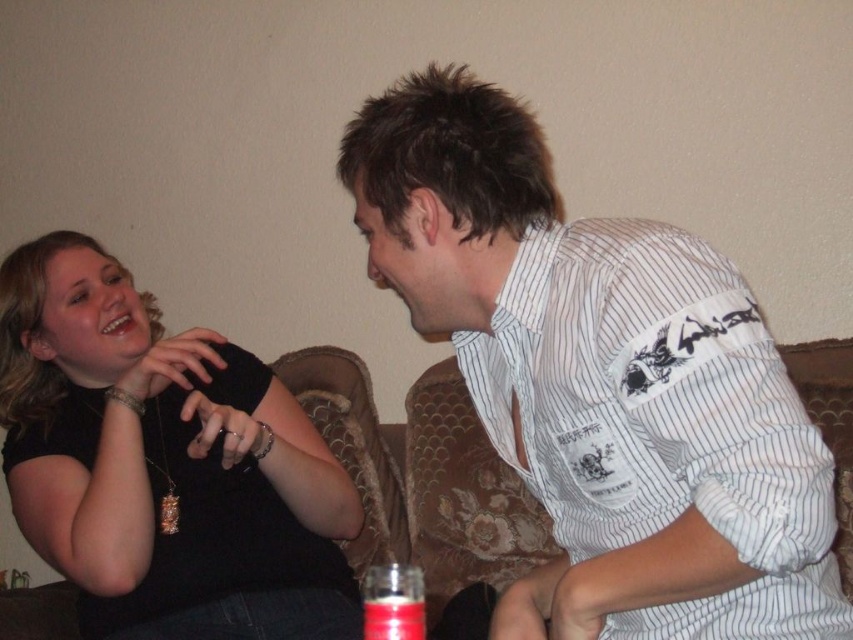
Question: Based on their relative distances, which object is nearer to the translucent glass bottle at lower center?

Choices:
 (A) velvet floral couch at center
 (B) white striped shirt at upper right
 (C) black matte necklace at upper left

Answer: (B)

Question: Observing the image, what is the correct spatial positioning of velvet floral couch at center in reference to translucent glass bottle at lower center?

Choices:
 (A) left
 (B) right

Answer: (A)

Question: Which of the following is the farthest from the observer?

Choices:
 (A) (457, 561)
 (B) (767, 388)

Answer: (A)

Question: Which of the following is the farthest from the observer?

Choices:
 (A) velvet floral couch at center
 (B) white striped shirt at upper right

Answer: (A)

Question: Does black matte necklace at upper left appear on the left side of translucent glass bottle at lower center?

Choices:
 (A) no
 (B) yes

Answer: (B)

Question: Does black matte necklace at upper left have a greater width compared to translucent glass bottle at lower center?

Choices:
 (A) yes
 (B) no

Answer: (A)